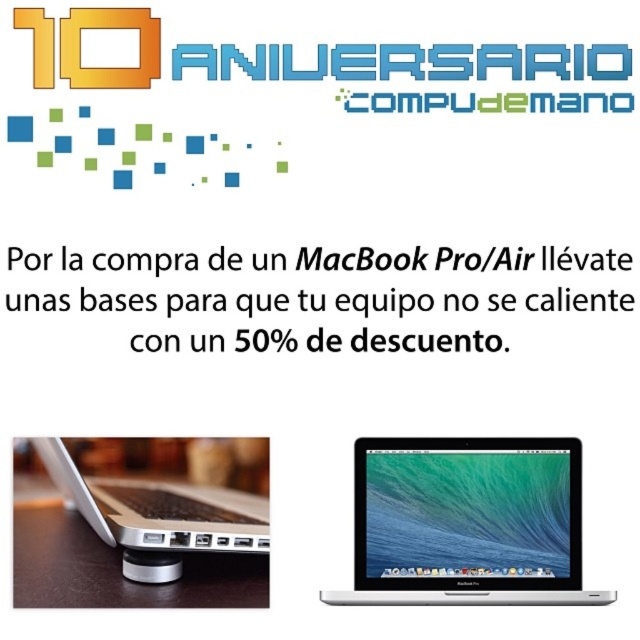
Does silver metallic laptop at center have a smaller size compared to silver metallic laptop at lower left?

Correct, silver metallic laptop at center occupies less space than silver metallic laptop at lower left.

Who is more forward, (490, 556) or (35, 440)?

Positioned in front is point (490, 556).

Locate an element on the screen. This screenshot has width=640, height=640. silver metallic laptop at center is located at coordinates (467, 522).

The height and width of the screenshot is (640, 640). What are the coordinates of `silver metallic laptop at center` in the screenshot? It's located at (467, 522).